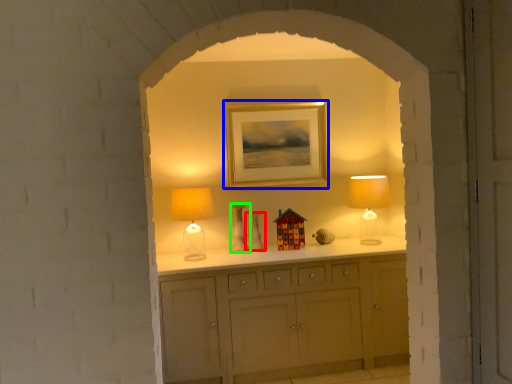
Question: Which is farther away from vase (highlighted by a red box)? picture frame (highlighted by a blue box) or vase (highlighted by a green box)?

Choices:
 (A) picture frame
 (B) vase

Answer: (A)